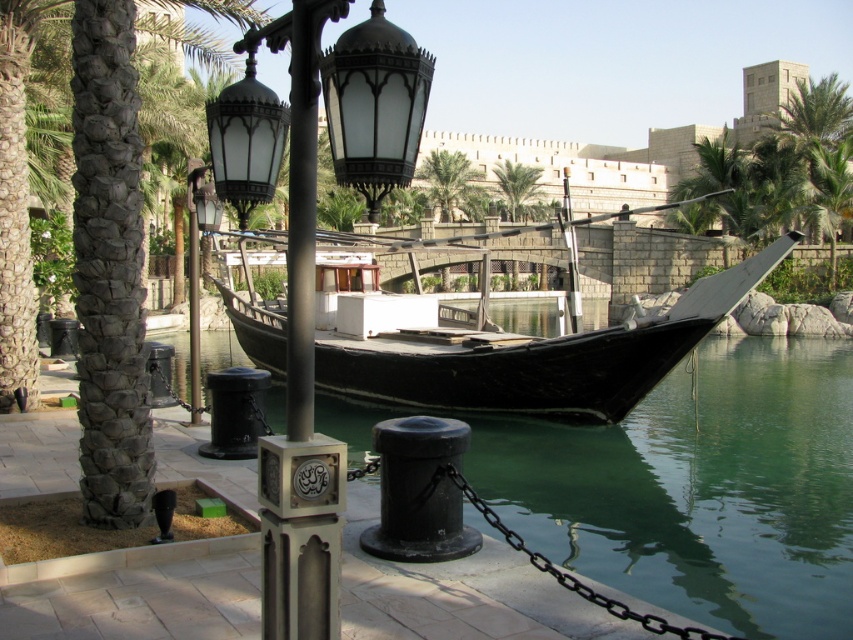
Which is behind, point (432, 339) or point (523, 168)?

The point (523, 168) is more distant.

Does black polished wood boat at center appear under green leafy palm tree at center?

Correct, black polished wood boat at center is located below green leafy palm tree at center.

Is point (460, 321) positioned after point (538, 208)?

No.

Where is `black polished wood boat at center`? The width and height of the screenshot is (853, 640). black polished wood boat at center is located at coordinates (517, 352).

Between black polished wood boat at center and green leafy palm tree at upper center, which one is positioned lower?

black polished wood boat at center is lower down.

What do you see at coordinates (517, 352) in the screenshot? Image resolution: width=853 pixels, height=640 pixels. I see `black polished wood boat at center` at bounding box center [517, 352].

Where is `black polished wood boat at center`? This screenshot has height=640, width=853. black polished wood boat at center is located at coordinates tap(517, 352).

Which is below, green water at boat right or matte black street light at center?

Positioned lower is green water at boat right.

Can you confirm if green water at boat right is positioned to the left of matte black street light at center?

Incorrect, green water at boat right is not on the left side of matte black street light at center.

Who is more distant from viewer, (670, 406) or (221, 211)?

Positioned behind is point (670, 406).

Image resolution: width=853 pixels, height=640 pixels. What are the coordinates of `green water at boat right` in the screenshot? It's located at (699, 488).